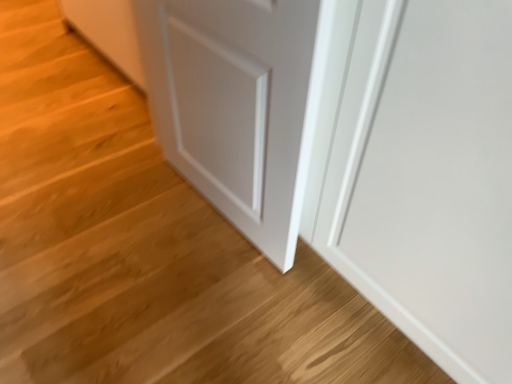
This screenshot has height=384, width=512. Find the location of `white matte door at center`. white matte door at center is located at coordinates (236, 106).

Describe the element at coordinates (236, 106) in the screenshot. I see `white matte door at center` at that location.

You are a GUI agent. You are given a task and a screenshot of the screen. Output one action in this format:
    pyautogui.click(x=<x>, y=<y>)
    Task: Click on the white matte door at center
    This screenshot has width=512, height=384.
    Given the screenshot: What is the action you would take?
    pyautogui.click(x=236, y=106)